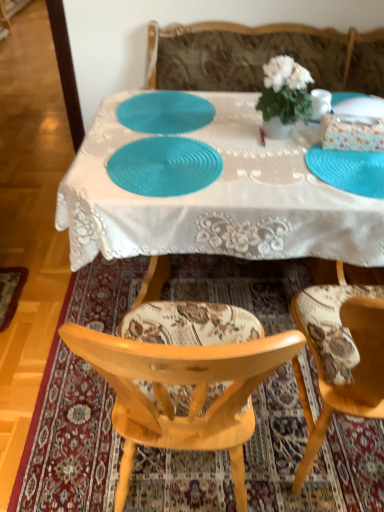
Where is `vacant space that is in between blue rubber placemat at lower right, the 1th plate viewed from the right, and teal textured plate at center, acting as the 2th plate starting from the left`? This screenshot has width=384, height=512. vacant space that is in between blue rubber placemat at lower right, the 1th plate viewed from the right, and teal textured plate at center, acting as the 2th plate starting from the left is located at coordinates (267, 169).